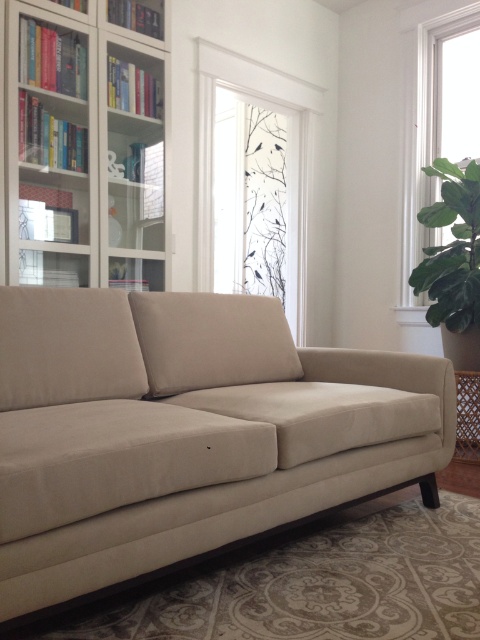
You are standing in the living room and want to determine the relative positions of two points marked in the image. Which point is closer to you, point (90, 353) or point (241, 339)?

Point (90, 353) is closer to the camera than point (241, 339).

You are standing in the living room and want to know where the transparent glass window at upper center is located. Can you describe its position using coordinates?

The transparent glass window at upper center is located at coordinates point (288, 157).